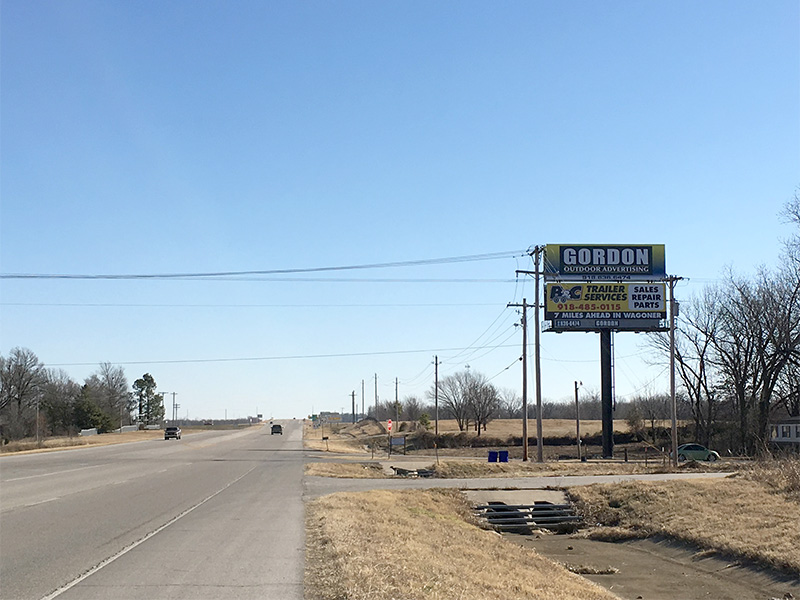
The width and height of the screenshot is (800, 600). I want to click on trashcan, so click(x=504, y=459), click(x=492, y=456).